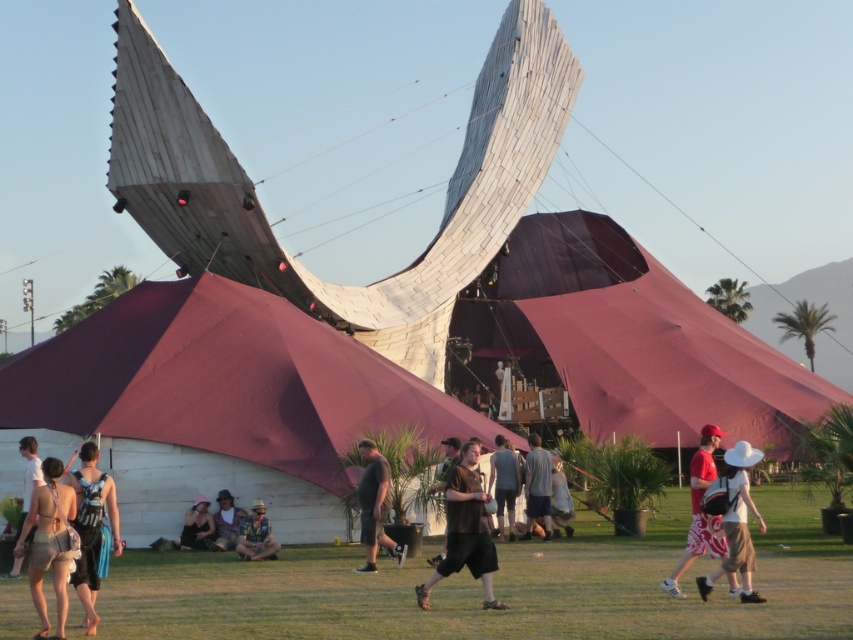
Question: Can you confirm if maroon fabric tent at center is smaller than matte black tank top at lower left?

Choices:
 (A) yes
 (B) no

Answer: (B)

Question: Is blue striped tank top at center thinner than dark gray t-shirt at center?

Choices:
 (A) no
 (B) yes

Answer: (A)

Question: Among these points, which one is nearest to the camera?

Choices:
 (A) (811, 634)
 (B) (61, 561)
 (C) (550, 484)

Answer: (A)

Question: Is dark gray t-shirt at center below gray fabric shirt at center?

Choices:
 (A) yes
 (B) no

Answer: (A)

Question: Among these points, which one is farthest from the camera?

Choices:
 (A) (28, 560)
 (B) (209, 538)

Answer: (B)

Question: Based on their relative distances, which object is nearer to the denim shorts at center?

Choices:
 (A) brown fabric shirt at center
 (B) white cotton shorts at center
 (C) maroon fabric canopy at center

Answer: (A)